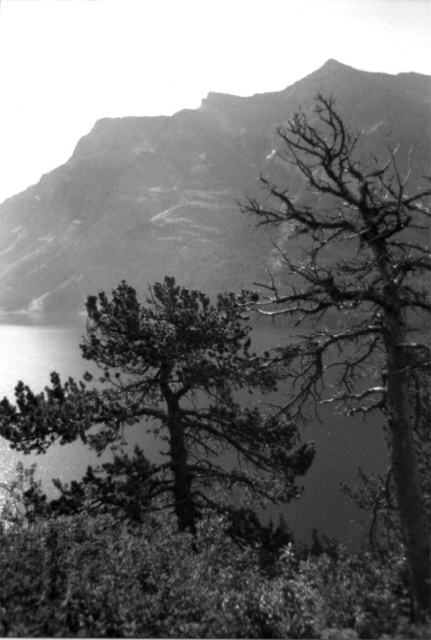
Does rugged stone mountain at upper center appear under dead wood tree at upper right?

Incorrect, rugged stone mountain at upper center is not positioned below dead wood tree at upper right.

Who is more distant from viewer, [178,188] or [309,353]?

Point [178,188]

At what (x,y) coordinates should I click in order to perform the action: click on rugged stone mountain at upper center. Please return your answer as a coordinate pair (x, y). The height and width of the screenshot is (640, 431). Looking at the image, I should click on (181, 188).

Can you confirm if rugged stone mountain at upper center is wider than dark green textured tree at center?

Correct, the width of rugged stone mountain at upper center exceeds that of dark green textured tree at center.

Which is above, rugged stone mountain at upper center or dark green textured tree at center?

Positioned higher is rugged stone mountain at upper center.

Image resolution: width=431 pixels, height=640 pixels. What do you see at coordinates (181, 188) in the screenshot?
I see `rugged stone mountain at upper center` at bounding box center [181, 188].

Find the location of a particular element. rugged stone mountain at upper center is located at coordinates (181, 188).

Where is `dark green textured tree at center`? The width and height of the screenshot is (431, 640). dark green textured tree at center is located at coordinates (165, 404).

Is dark green textured tree at center taller than dead wood tree at upper right?

No.

Image resolution: width=431 pixels, height=640 pixels. Identify the location of dark green textured tree at center. (165, 404).